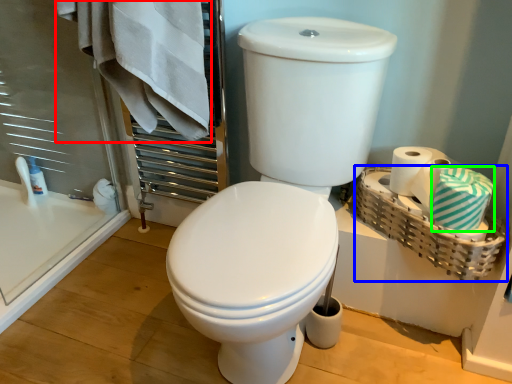
Question: Estimate the real-world distances between objects in this image. Which object is farther from bath towel (highlighted by a red box), basket (highlighted by a blue box) or bath towel (highlighted by a green box)?

Choices:
 (A) basket
 (B) bath towel

Answer: (B)